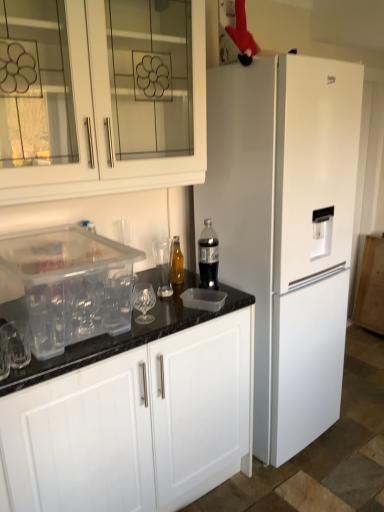
At what (x,y) coordinates should I click in order to perform the action: click on free space in front of translucent glass bottle at center, the second bottle in the front-to-back sequence. Please return your answer as a coordinate pair (x, y). The width and height of the screenshot is (384, 512). Looking at the image, I should click on (178, 294).